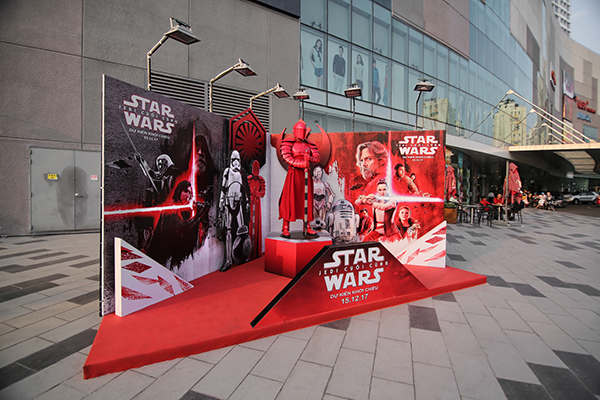
Identify the location of tile. This screenshot has height=400, width=600. (508, 367).